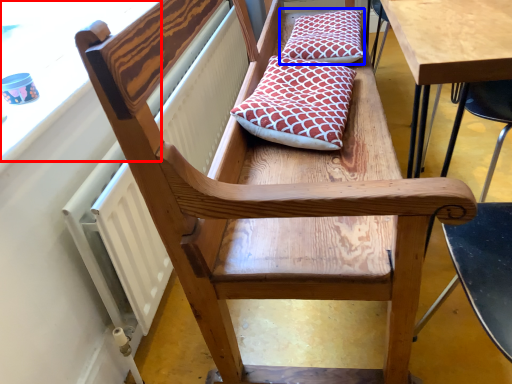
Question: Which object appears farthest to the camera in this image, window screen (highlighted by a red box) or pillow (highlighted by a blue box)?

Choices:
 (A) window screen
 (B) pillow

Answer: (B)